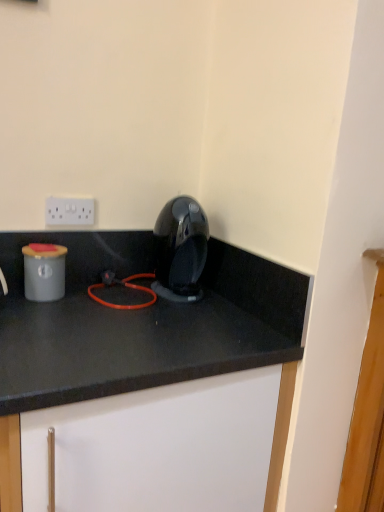
This screenshot has width=384, height=512. Find the location of `free spot in front of glossy plastic coffee machine at center`. free spot in front of glossy plastic coffee machine at center is located at coordinates point(180,315).